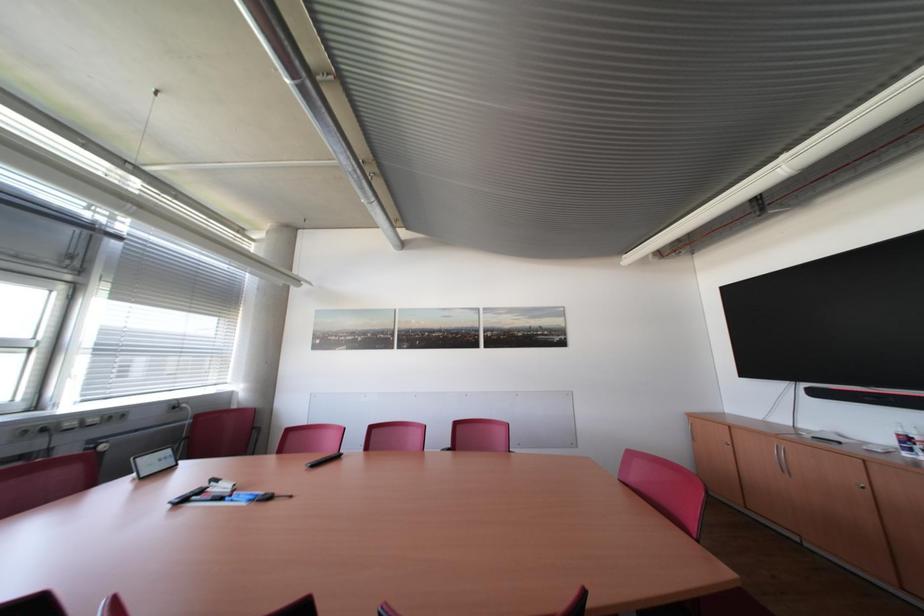
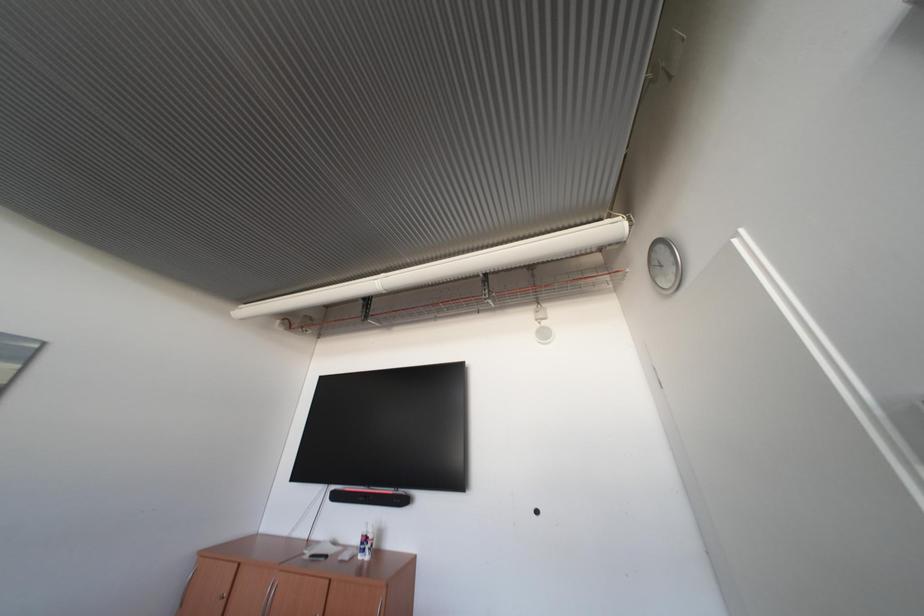
From the picture: The images are taken continuously from a first-person perspective. In which direction is your viewpoint rotating?

The camera rotated toward right-up.